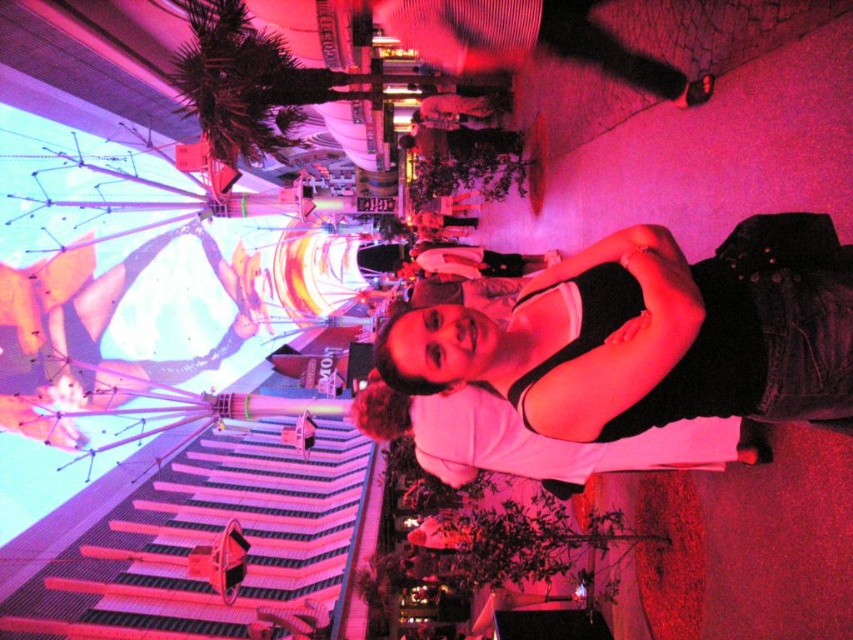
Question: Which point is closer to the camera?

Choices:
 (A) (462, 326)
 (B) (90, 324)

Answer: (A)

Question: Is black denim jacket at center positioned before white matte shirt at center?

Choices:
 (A) yes
 (B) no

Answer: (A)

Question: Which point is farther to the camera?

Choices:
 (A) (727, 392)
 (B) (49, 392)

Answer: (B)

Question: Is black denim jacket at center bigger than white matte shirt at center?

Choices:
 (A) yes
 (B) no

Answer: (B)

Question: Can you confirm if black denim jacket at center is bigger than white matte shirt at center?

Choices:
 (A) no
 (B) yes

Answer: (A)